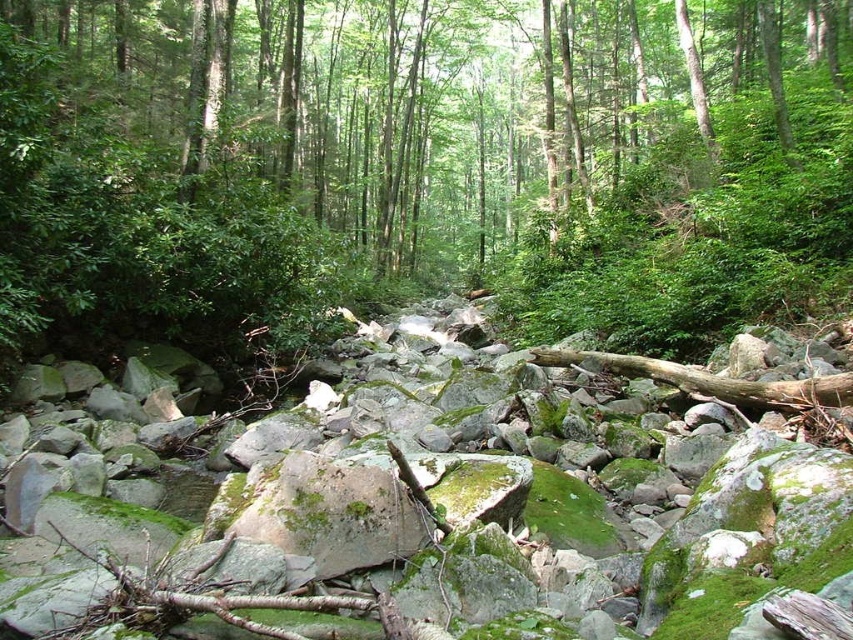
Question: Does green mossy rock at center appear under mossy rock at center?

Choices:
 (A) yes
 (B) no

Answer: (B)

Question: Observing the image, what is the correct spatial positioning of green mossy rock at center in reference to mossy rock at center?

Choices:
 (A) below
 (B) above

Answer: (B)

Question: Which point appears farthest from the camera in this image?

Choices:
 (A) (656, 625)
 (B) (723, 108)

Answer: (B)

Question: Can you confirm if green mossy rock at center is positioned to the right of mossy rock at center?

Choices:
 (A) yes
 (B) no

Answer: (A)

Question: Which point is closer to the camera?

Choices:
 (A) mossy rock at center
 (B) green mossy rock at center

Answer: (A)